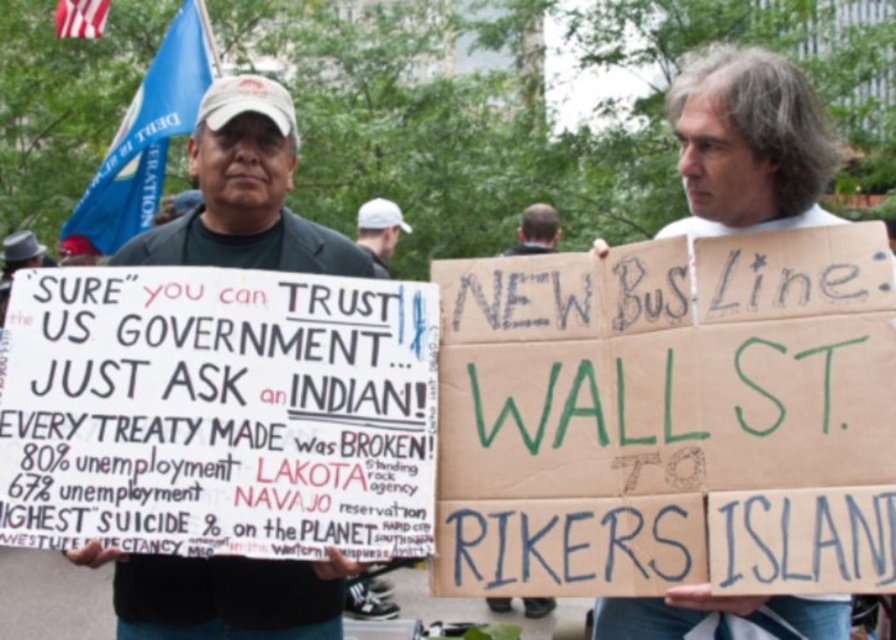
Question: Is dark green shirt at center thinner than dark brown hair at center?

Choices:
 (A) yes
 (B) no

Answer: (B)

Question: Where is white cardboard sign at center located in relation to dark brown hair at center in the image?

Choices:
 (A) above
 (B) below

Answer: (A)

Question: Which of the following is the farthest from the observer?

Choices:
 (A) dark brown hair at center
 (B) dark green shirt at center

Answer: (A)

Question: Which object is the closest to the dark brown hair at center?

Choices:
 (A) white matte baseball cap at center
 (B) white cardboard sign at center

Answer: (A)

Question: Does dark green shirt at center appear over white cardboard sign at center?

Choices:
 (A) yes
 (B) no

Answer: (B)

Question: Based on their relative distances, which object is farther from the dark brown hair at center?

Choices:
 (A) white matte baseball cap at center
 (B) white cardboard sign at center
 (C) dark green shirt at center

Answer: (C)